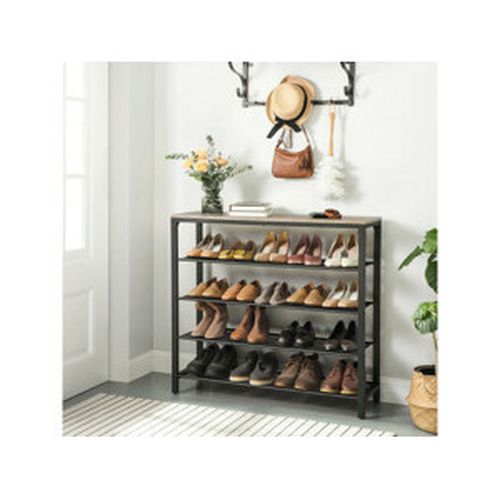
At what (x,y) coordinates should I click in order to perform the action: click on shoes on top shelf. Please return your answer as a coordinate pair (x, y). This screenshot has height=500, width=500. Looking at the image, I should click on (x=197, y=252), (x=207, y=252), (x=231, y=253), (x=242, y=253), (x=260, y=254), (x=275, y=257), (x=294, y=257), (x=309, y=257), (x=331, y=257), (x=349, y=259).